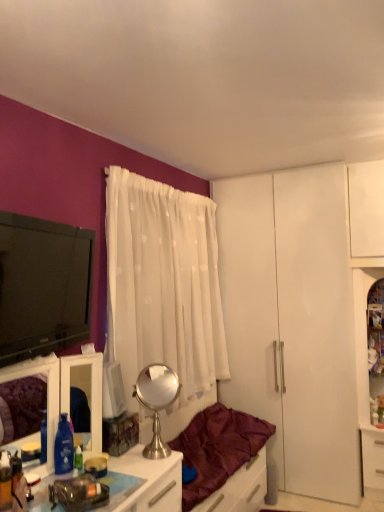
This screenshot has width=384, height=512. Describe the element at coordinates (144, 483) in the screenshot. I see `translucent plastic desk at lower left` at that location.

This screenshot has height=512, width=384. In order to click on white matte drawer at lower right in this screenshot , I will do `click(372, 457)`.

Who is taller, metallic silver vanity at lower left or velvet burgundy studio couch at center?

metallic silver vanity at lower left is taller.

Is metallic silver vanity at lower left situated inside velvet burgundy studio couch at center or outside?

metallic silver vanity at lower left is outside velvet burgundy studio couch at center.

From the image's perspective, which is below, metallic silver vanity at lower left or velvet burgundy studio couch at center?

velvet burgundy studio couch at center.

Considering the relative sizes of metallic silver vanity at lower left and velvet burgundy studio couch at center in the image provided, is metallic silver vanity at lower left thinner than velvet burgundy studio couch at center?

Yes, metallic silver vanity at lower left is thinner than velvet burgundy studio couch at center.

Which of these two, polished silver mirror at center or metallic silver vanity at lower left, is smaller?

Smaller between the two is polished silver mirror at center.

Where is `cabinetry above the polished silver mirror at center (from the image's perspective)`? This screenshot has width=384, height=512. cabinetry above the polished silver mirror at center (from the image's perspective) is located at coordinates (62, 392).

Is polished silver mirror at center with metallic silver vanity at lower left?

polished silver mirror at center and metallic silver vanity at lower left are clearly separated.

From a real-world perspective, is polished silver mirror at center over metallic silver vanity at lower left?

No, from a real-world perspective, polished silver mirror at center is not above metallic silver vanity at lower left.

Does velvet burgundy studio couch at center appear on the right side of metallic silver vanity at lower left?

Indeed, velvet burgundy studio couch at center is positioned on the right side of metallic silver vanity at lower left.

Image resolution: width=384 pixels, height=512 pixels. What are the coordinates of `cabinetry located on the left of velvet burgundy studio couch at center` in the screenshot? It's located at (62, 392).

Is velvet burgundy studio couch at center smaller than metallic silver vanity at lower left?

No, velvet burgundy studio couch at center is not smaller than metallic silver vanity at lower left.

Can you confirm if velvet burgundy studio couch at center is thinner than metallic silver vanity at lower left?

No, velvet burgundy studio couch at center is not thinner than metallic silver vanity at lower left.

Can you confirm if translucent plastic desk at lower left is bigger than velvet burgundy studio couch at center?

No, translucent plastic desk at lower left is not bigger than velvet burgundy studio couch at center.

Which of these two, translucent plastic desk at lower left or velvet burgundy studio couch at center, is wider?

velvet burgundy studio couch at center.

Can you tell me how much translucent plastic desk at lower left and velvet burgundy studio couch at center differ in facing direction?

translucent plastic desk at lower left and velvet burgundy studio couch at center are facing 1.43 degrees away from each other.

Is velvet burgundy studio couch at center at the back of translucent plastic desk at lower left?

translucent plastic desk at lower left is not turned away from velvet burgundy studio couch at center.

Consider the image. Is white sheer curtain at center facing towards velvet burgundy studio couch at center?

No, white sheer curtain at center is not turned towards velvet burgundy studio couch at center.

Would you say white sheer curtain at center is inside or outside velvet burgundy studio couch at center?

white sheer curtain at center is spatially situated outside velvet burgundy studio couch at center.

Considering the sizes of objects white sheer curtain at center and velvet burgundy studio couch at center in the image provided, who is shorter, white sheer curtain at center or velvet burgundy studio couch at center?

velvet burgundy studio couch at center is shorter.

From a real-world perspective, relative to velvet burgundy studio couch at center, is white sheer curtain at center vertically above or below?

white sheer curtain at center is above velvet burgundy studio couch at center.

Is metallic silver vanity at lower left at the back of black glossy television at left?

black glossy television at left does not have its back to metallic silver vanity at lower left.

Looking at this image, is metallic silver vanity at lower left a part of black glossy television at left?

That's incorrect, metallic silver vanity at lower left is not inside black glossy television at left.

From the image's perspective, does black glossy television at left appear lower than metallic silver vanity at lower left?

Actually, black glossy television at left appears above metallic silver vanity at lower left in the image.

Which object is thinner, black glossy television at left or metallic silver vanity at lower left?

black glossy television at left.

Consider the image. Based on their positions, is black glossy television at left located to the left or right of white sheer curtain at center?

Based on their positions, black glossy television at left is located to the left of white sheer curtain at center.

Is black glossy television at left next to white sheer curtain at center and touching it?

black glossy television at left and white sheer curtain at center are clearly separated.

Is black glossy television at left oriented towards white sheer curtain at center?

No, black glossy television at left is not turned towards white sheer curtain at center.

You are a GUI agent. You are given a task and a screenshot of the screen. Output one action in this format:
    pyautogui.click(x=<x>, y=<y>)
    Task: Click on the television lying on the left of white sheer curtain at center
    
    Given the screenshot: What is the action you would take?
    (x=43, y=286)

Find the location of a particular element. studio couch below the metallic silver vanity at lower left (from the image's perspective) is located at coordinates (218, 448).

Find the location of a particular element. This screenshot has width=384, height=512. cabinetry lying on the left of polished silver mirror at center is located at coordinates (62, 392).

Considering their positions, is translucent plastic desk at lower left positioned further to polished silver mirror at center than white matte drawer at lower right?

white matte drawer at lower right lies further to polished silver mirror at center than the other object.

Based on their spatial positions, is metallic silver vanity at lower left or velvet burgundy studio couch at center further from polished silver mirror at center?

metallic silver vanity at lower left is further to polished silver mirror at center.

From the image, which object appears to be nearer to translucent plastic desk at lower left, black glossy television at left or metallic silver vanity at lower left?

metallic silver vanity at lower left is closer to translucent plastic desk at lower left.

Estimate the real-world distances between objects in this image. Which object is closer to black glossy television at left, velvet burgundy studio couch at center or white matte drawer at lower right?

velvet burgundy studio couch at center lies closer to black glossy television at left than the other object.

Which object lies further to the anchor point velvet burgundy studio couch at center, translucent plastic desk at lower left or polished silver mirror at center?

The object further to velvet burgundy studio couch at center is translucent plastic desk at lower left.

When comparing their distances from white sheer curtain at center, does velvet burgundy studio couch at center or translucent plastic desk at lower left seem further?

translucent plastic desk at lower left is positioned further to the anchor white sheer curtain at center.

Looking at the image, which one is located closer to velvet burgundy studio couch at center, metallic silver vanity at lower left or translucent plastic desk at lower left?

Among the two, translucent plastic desk at lower left is located nearer to velvet burgundy studio couch at center.

From the image, which object appears to be nearer to translucent plastic desk at lower left, clear glass cabinet at right or white sheer curtain at center?

white sheer curtain at center is positioned closer to the anchor translucent plastic desk at lower left.

Locate an element on the screen. desk between metallic silver vanity at lower left and clear glass cabinet at right in the horizontal direction is located at coordinates (144, 483).

This screenshot has height=512, width=384. I want to click on desk between black glossy television at left and white sheer curtain at center along the z-axis, so pos(144,483).

Find the location of a particular element. This screenshot has height=512, width=384. studio couch located between black glossy television at left and white matte drawer at lower right in the left-right direction is located at coordinates (218, 448).

Where is `drawer located between metallic silver vanity at lower left and clear glass cabinet at right in the left-right direction`? This screenshot has height=512, width=384. drawer located between metallic silver vanity at lower left and clear glass cabinet at right in the left-right direction is located at coordinates (372, 457).